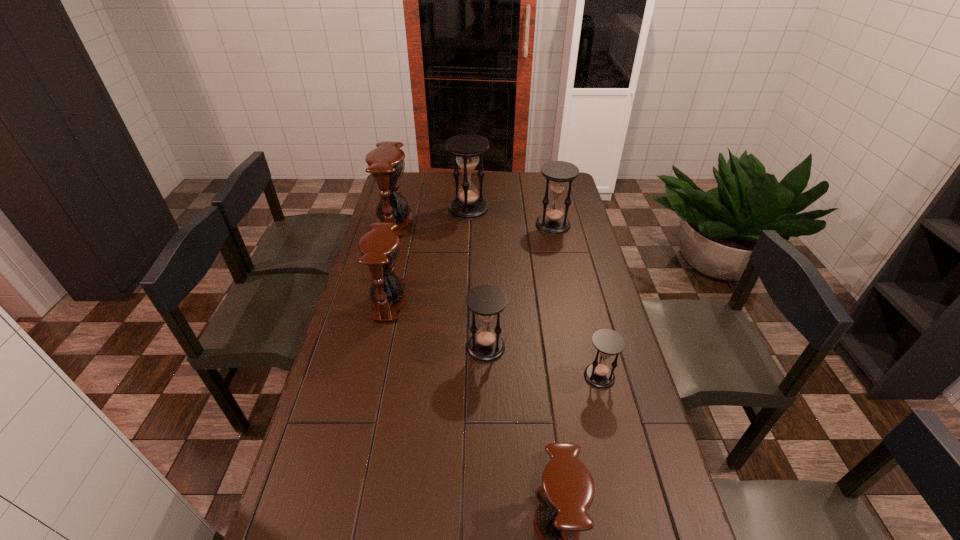
This screenshot has height=540, width=960. I want to click on the biggest black hourglass, so click(467, 205).

Locate an element on the screen. the farthest brown hourglass is located at coordinates (386, 165).

Where is `the third smallest black hourglass`? Image resolution: width=960 pixels, height=540 pixels. the third smallest black hourglass is located at coordinates (558, 173).

Locate an element on the screen. This screenshot has height=540, width=960. the second nearest brown hourglass is located at coordinates (379, 248).

Identify the location of the fourth nearest hourglass. 379,248.

Where is `the fifth farthest hourglass`? This screenshot has width=960, height=540. the fifth farthest hourglass is located at coordinates (486, 301).

In order to click on the third nearest object in this screenshot , I will do `click(486, 301)`.

I want to click on the shortest hourglass, so click(608, 343).

What are the coordinates of `the shortest object` in the screenshot? It's located at (608, 343).

What are the coordinates of `free space located on the right of the biggest black hourglass` in the screenshot? It's located at pyautogui.click(x=506, y=209).